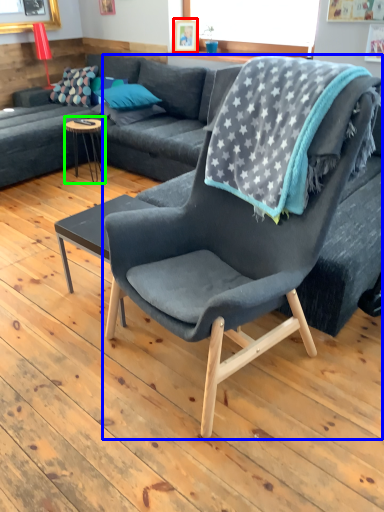
Question: Which object is the farthest from picture frame (highlighted by a red box)? Choose among these: chair (highlighted by a blue box) or coffee table (highlighted by a green box).

Choices:
 (A) chair
 (B) coffee table

Answer: (A)